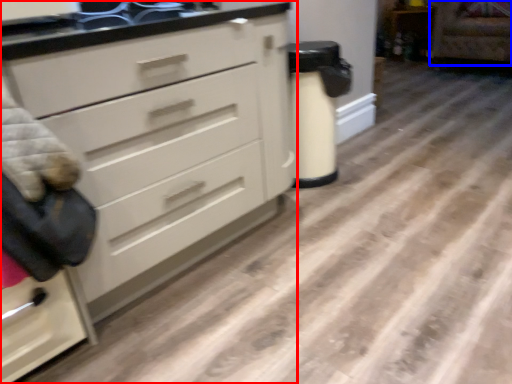
Question: Which object is further to the camera taking this photo, chest of drawers (highlighted by a red box) or armchair (highlighted by a blue box)?

Choices:
 (A) chest of drawers
 (B) armchair

Answer: (B)